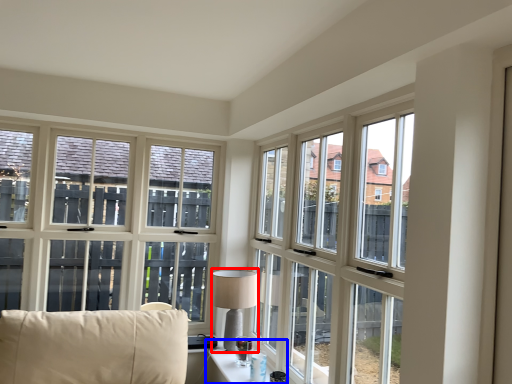
Question: Which object is further to the camera taking this photo, table lamp (highlighted by a red box) or table (highlighted by a blue box)?

Choices:
 (A) table lamp
 (B) table

Answer: (A)